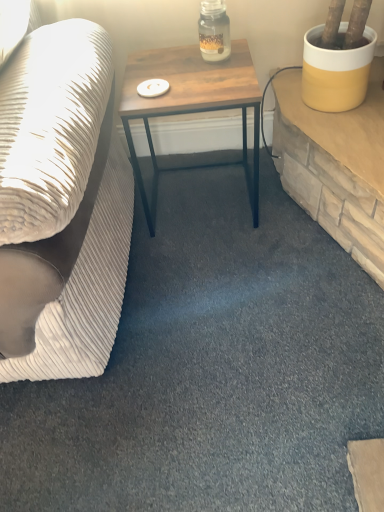
Question: From a real-world perspective, is wooden table at center positioned under white textured fabric couch at left based on gravity?

Choices:
 (A) yes
 (B) no

Answer: (A)

Question: Is wooden table at center far from white textured fabric couch at left?

Choices:
 (A) no
 (B) yes

Answer: (A)

Question: Is wooden table at center in front of white textured fabric couch at left?

Choices:
 (A) yes
 (B) no

Answer: (B)

Question: Considering the relative positions of wooden table at center and white textured fabric couch at left in the image provided, is wooden table at center to the right of white textured fabric couch at left from the viewer's perspective?

Choices:
 (A) yes
 (B) no

Answer: (A)

Question: From a real-world perspective, is wooden table at center on top of white textured fabric couch at left?

Choices:
 (A) yes
 (B) no

Answer: (B)

Question: Is wooden table at center positioned behind white textured fabric couch at left?

Choices:
 (A) yes
 (B) no

Answer: (A)

Question: Is wooden table at center at the right side of translucent glass jar at center?

Choices:
 (A) yes
 (B) no

Answer: (B)

Question: Can translucent glass jar at center be found inside wooden table at center?

Choices:
 (A) yes
 (B) no

Answer: (B)

Question: Is wooden table at center positioned in front of translucent glass jar at center?

Choices:
 (A) no
 (B) yes

Answer: (B)

Question: Are wooden table at center and translucent glass jar at center far apart?

Choices:
 (A) no
 (B) yes

Answer: (A)

Question: Is wooden table at center thinner than translucent glass jar at center?

Choices:
 (A) no
 (B) yes

Answer: (A)

Question: Can you confirm if wooden table at center is smaller than translucent glass jar at center?

Choices:
 (A) yes
 (B) no

Answer: (B)

Question: Is white textured fabric couch at left closer to the viewer compared to wooden table at center?

Choices:
 (A) no
 (B) yes

Answer: (B)